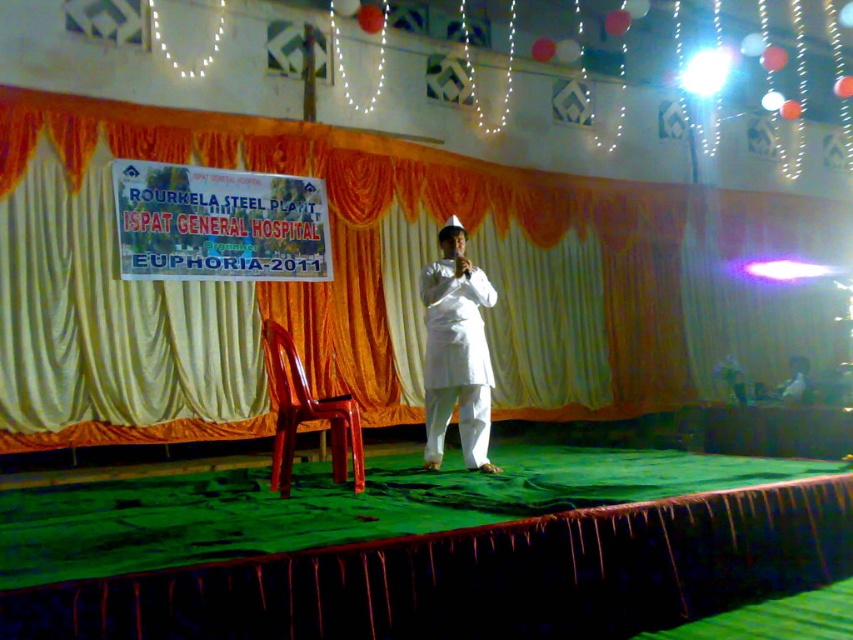
Does orange fabric curtain at upper center have a greater width compared to glossy plastic chair at center?

Yes.

Which is behind, point (747, 198) or point (318, 403)?

Positioned behind is point (747, 198).

Which is in front, point (379, 152) or point (332, 433)?

Positioned in front is point (332, 433).

Where is `orange fabric curtain at upper center`? orange fabric curtain at upper center is located at coordinates (438, 220).

Who is positioned more to the right, orange fabric curtain at upper center or white cotton kurta at center?

orange fabric curtain at upper center is more to the right.

Is orange fabric curtain at upper center thinner than white cotton kurta at center?

In fact, orange fabric curtain at upper center might be wider than white cotton kurta at center.

The height and width of the screenshot is (640, 853). What do you see at coordinates (438, 220) in the screenshot? I see `orange fabric curtain at upper center` at bounding box center [438, 220].

Find the location of a particular element. The width and height of the screenshot is (853, 640). orange fabric curtain at upper center is located at coordinates (438, 220).

This screenshot has height=640, width=853. What do you see at coordinates (456, 356) in the screenshot?
I see `white cotton kurta at center` at bounding box center [456, 356].

At what (x,y) coordinates should I click in order to perform the action: click on white cotton kurta at center. Please return your answer as a coordinate pair (x, y). This screenshot has width=853, height=640. Looking at the image, I should click on (456, 356).